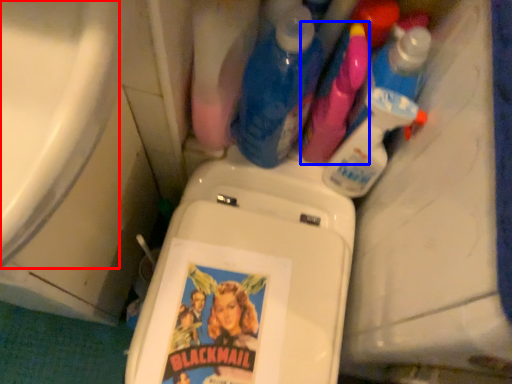
Question: Among these objects, which one is nearest to the camera, bath (highlighted by a red box) or cleaning product (highlighted by a blue box)?

Choices:
 (A) bath
 (B) cleaning product

Answer: (A)